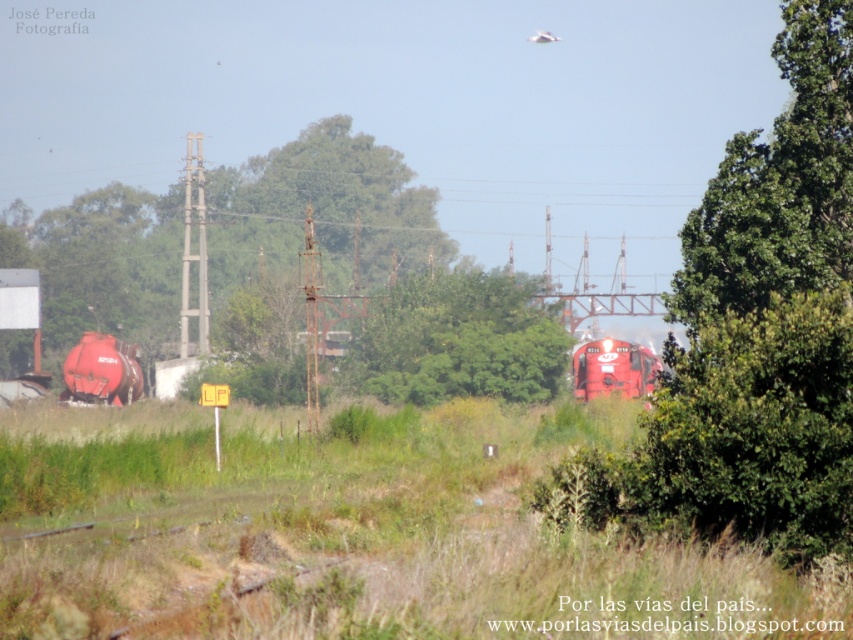
Question: Can you confirm if green leafy tree at center is wider than matte red tank car at left?

Choices:
 (A) yes
 (B) no

Answer: (A)

Question: Based on their relative distances, which object is farther from the matte red tank car at left?

Choices:
 (A) green leafy tree at center
 (B) shiny red train at center

Answer: (B)

Question: Does green leafy tree at center appear under matte red tank car at left?

Choices:
 (A) no
 (B) yes

Answer: (A)

Question: Which object is the farthest from the green leafy tree at center?

Choices:
 (A) matte red tank car at left
 (B) shiny red train at center

Answer: (A)

Question: Which point appears closest to the camera in this image?

Choices:
 (A) (78, 394)
 (B) (529, 353)
 (C) (579, 352)

Answer: (B)

Question: Is green leafy tree at center thinner than matte red tank car at left?

Choices:
 (A) no
 (B) yes

Answer: (A)